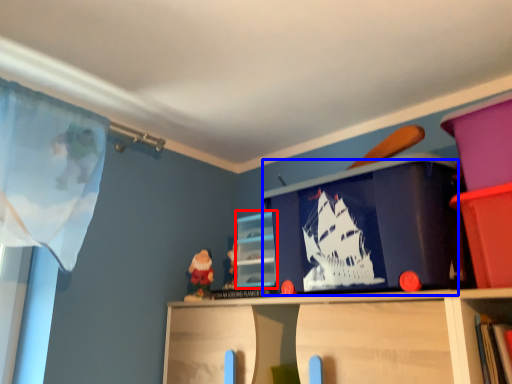
Question: Which object is closer to the camera taking this photo, cabinet (highlighted by a red box) or window screen (highlighted by a blue box)?

Choices:
 (A) cabinet
 (B) window screen

Answer: (B)